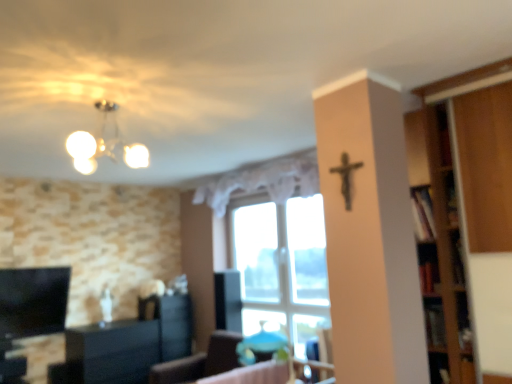
Question: Considering the relative sizes of matte white chandelier at upper left and white lace curtain at center in the image provided, is matte white chandelier at upper left shorter than white lace curtain at center?

Choices:
 (A) yes
 (B) no

Answer: (A)

Question: Does matte white chandelier at upper left appear on the right side of white lace curtain at center?

Choices:
 (A) no
 (B) yes

Answer: (A)

Question: Is matte white chandelier at upper left aimed at white lace curtain at center?

Choices:
 (A) yes
 (B) no

Answer: (B)

Question: Considering the relative positions of matte white chandelier at upper left and white lace curtain at center in the image provided, is matte white chandelier at upper left to the left of white lace curtain at center from the viewer's perspective?

Choices:
 (A) no
 (B) yes

Answer: (B)

Question: Is matte white chandelier at upper left next to white lace curtain at center and touching it?

Choices:
 (A) yes
 (B) no

Answer: (B)

Question: Visually, is matte white chandelier at upper left positioned to the left or to the right of black matte crucifix at upper center?

Choices:
 (A) right
 (B) left

Answer: (B)

Question: Looking at the image, does matte white chandelier at upper left seem bigger or smaller compared to black matte crucifix at upper center?

Choices:
 (A) big
 (B) small

Answer: (A)

Question: From the image's perspective, is matte white chandelier at upper left located above or below black matte crucifix at upper center?

Choices:
 (A) above
 (B) below

Answer: (A)

Question: Does point (99, 107) appear closer or farther from the camera than point (345, 160)?

Choices:
 (A) farther
 (B) closer

Answer: (A)

Question: From the image's perspective, is transparent glass window at center positioned above or below matte white chandelier at upper left?

Choices:
 (A) above
 (B) below

Answer: (B)

Question: Would you say transparent glass window at center is to the left or to the right of matte white chandelier at upper left in the picture?

Choices:
 (A) left
 (B) right

Answer: (B)

Question: Considering the positions of transparent glass window at center and matte white chandelier at upper left in the image, is transparent glass window at center taller or shorter than matte white chandelier at upper left?

Choices:
 (A) short
 (B) tall

Answer: (B)

Question: Based on their sizes in the image, would you say transparent glass window at center is bigger or smaller than matte white chandelier at upper left?

Choices:
 (A) big
 (B) small

Answer: (A)

Question: Choose the correct answer: Is black glossy cabinet at lower left inside wooden bookshelf at lower right or outside it?

Choices:
 (A) inside
 (B) outside

Answer: (B)

Question: Is black glossy cabinet at lower left taller or shorter than wooden bookshelf at lower right?

Choices:
 (A) tall
 (B) short

Answer: (A)